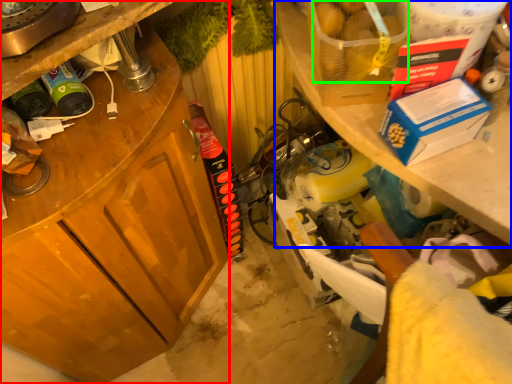
Question: Based on their relative distances, which object is nearer to cabinetry (highlighted by a red box)? Choose from shelf (highlighted by a blue box) and food (highlighted by a green box).

Choices:
 (A) shelf
 (B) food

Answer: (A)